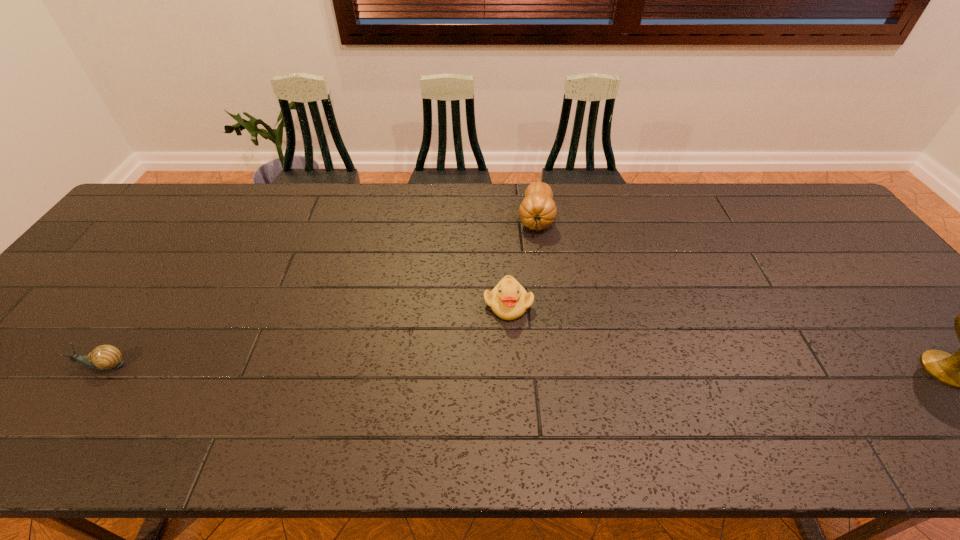
Locate an element on the screen. Image resolution: width=960 pixels, height=540 pixels. the shortest object is located at coordinates (105, 357).

Locate an element on the screen. Image resolution: width=960 pixels, height=540 pixels. escargot is located at coordinates (105, 357).

You are a GUI agent. You are given a task and a screenshot of the screen. Output one action in this format:
    pyautogui.click(x=<x>, y=<y>)
    Task: Click on the gourd
    
    Given the screenshot: What is the action you would take?
    pyautogui.click(x=537, y=211)

This screenshot has height=540, width=960. In order to click on the farthest object in this screenshot , I will do `click(537, 211)`.

Locate an element on the screen. duckling is located at coordinates (509, 300).

Where is `the second shortest object`? Image resolution: width=960 pixels, height=540 pixels. the second shortest object is located at coordinates (509, 300).

Identify the location of vacant area located on the front-facing side of the leftmost object. The image size is (960, 540). (48, 366).

This screenshot has width=960, height=540. Identify the location of vacant space located 0.150m on the front-facing side of the leftmost object. (9, 366).

In order to click on free location located 0.120m on the front-facing side of the leftmost object in this screenshot , I will do `click(21, 366)`.

Where is `free space located 0.090m on the stem side of the gourd`? free space located 0.090m on the stem side of the gourd is located at coordinates tap(535, 262).